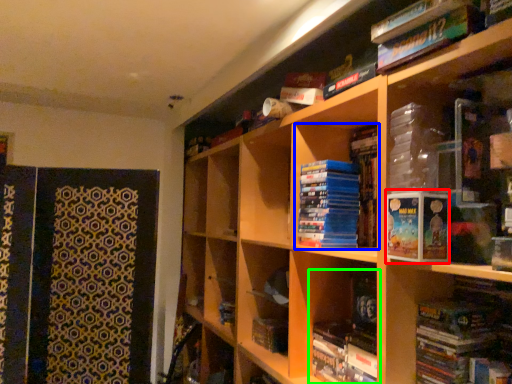
Question: Which object is the farthest from paperback book (highlighted by a red box)? Choose among these: book (highlighted by a blue box) or book (highlighted by a green box).

Choices:
 (A) book
 (B) book

Answer: (A)